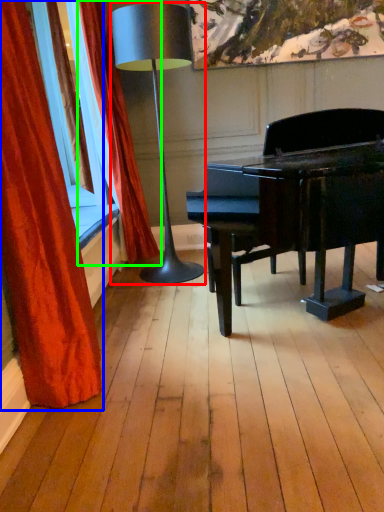
Question: Considering the real-world distances, which object is farthest from lamp (highlighted by a red box)? curtain (highlighted by a blue box) or curtain (highlighted by a green box)?

Choices:
 (A) curtain
 (B) curtain

Answer: (A)